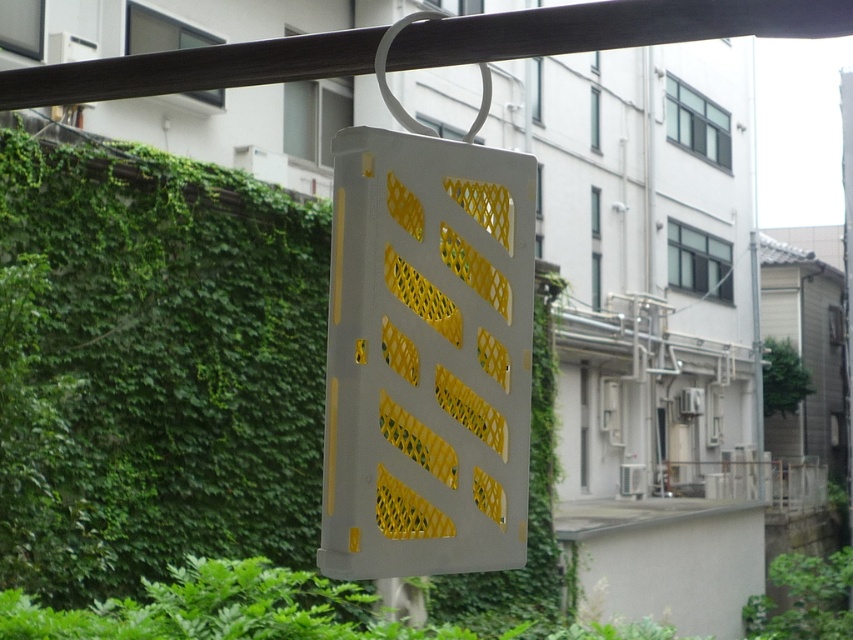
Question: Is green ivy at center positioned at the back of white plastic mesh at center?

Choices:
 (A) no
 (B) yes

Answer: (B)

Question: Can you confirm if green ivy at center is positioned to the left of white plastic mesh at center?

Choices:
 (A) no
 (B) yes

Answer: (B)

Question: Is green ivy at center below white plastic mesh at center?

Choices:
 (A) no
 (B) yes

Answer: (B)

Question: Which point is farther from the camera taking this photo?

Choices:
 (A) (399, 321)
 (B) (33, 468)

Answer: (B)

Question: Which point is closer to the camera taking this photo?

Choices:
 (A) (83, 214)
 (B) (503, 266)

Answer: (B)

Question: Which point is farther to the camera?

Choices:
 (A) (80, 285)
 (B) (387, 289)

Answer: (A)